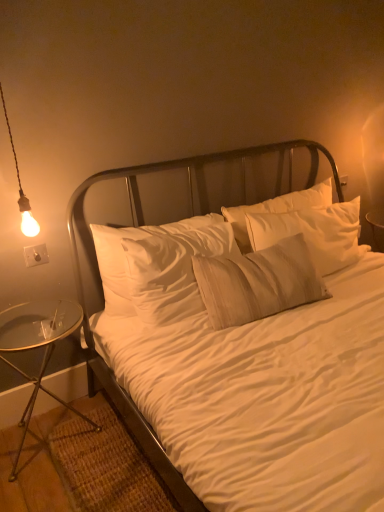
Question: From a real-world perspective, is transparent glass table at lower left physically below white cotton bed at center?

Choices:
 (A) yes
 (B) no

Answer: (A)

Question: Is transparent glass table at lower left wider than white cotton bed at center?

Choices:
 (A) no
 (B) yes

Answer: (A)

Question: Can you confirm if transparent glass table at lower left is taller than white cotton bed at center?

Choices:
 (A) yes
 (B) no

Answer: (B)

Question: Does transparent glass table at lower left have a smaller size compared to white cotton bed at center?

Choices:
 (A) no
 (B) yes

Answer: (B)

Question: Is transparent glass table at lower left positioned with its back to white cotton bed at center?

Choices:
 (A) yes
 (B) no

Answer: (B)

Question: From a real-world perspective, is metallic silver headboard at center physically located above or below matte bulb at left?

Choices:
 (A) below
 (B) above

Answer: (A)

Question: Based on their sizes in the image, would you say metallic silver headboard at center is bigger or smaller than matte bulb at left?

Choices:
 (A) big
 (B) small

Answer: (A)

Question: From the image's perspective, is metallic silver headboard at center located above or below matte bulb at left?

Choices:
 (A) above
 (B) below

Answer: (B)

Question: In terms of width, does metallic silver headboard at center look wider or thinner when compared to matte bulb at left?

Choices:
 (A) thin
 (B) wide

Answer: (B)

Question: Looking at the image, does white cotton bed at center seem bigger or smaller compared to metallic silver headboard at center?

Choices:
 (A) small
 (B) big

Answer: (B)

Question: From a real-world perspective, relative to metallic silver headboard at center, is white cotton bed at center vertically above or below?

Choices:
 (A) below
 (B) above

Answer: (A)

Question: Do you think white cotton bed at center is within metallic silver headboard at center, or outside of it?

Choices:
 (A) outside
 (B) inside

Answer: (A)

Question: Considering the positions of point (231, 156) and point (87, 323), is point (231, 156) closer or farther from the camera than point (87, 323)?

Choices:
 (A) closer
 (B) farther

Answer: (B)

Question: Visually, is metallic silver headboard at center positioned to the left or to the right of transparent glass table at lower left?

Choices:
 (A) left
 (B) right

Answer: (B)

Question: From the image's perspective, is metallic silver headboard at center located above or below transparent glass table at lower left?

Choices:
 (A) above
 (B) below

Answer: (A)